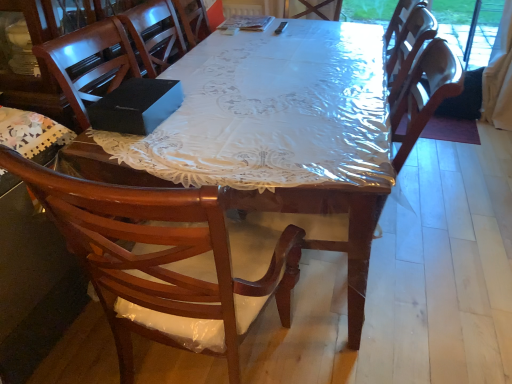
The image size is (512, 384). Identify the location of vacant point to the right of wooden armchair at center. (439, 284).